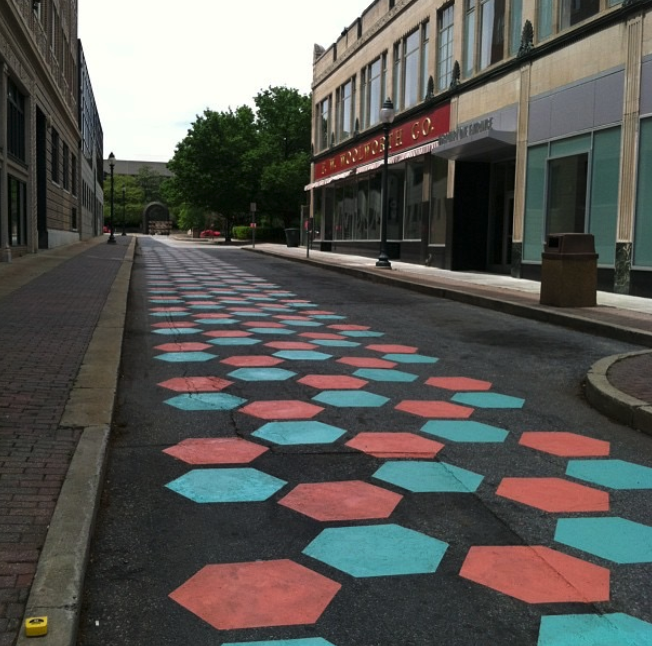
Locate an element on the screen. The height and width of the screenshot is (646, 652). doorway is located at coordinates (481, 200), (569, 211), (38, 205).